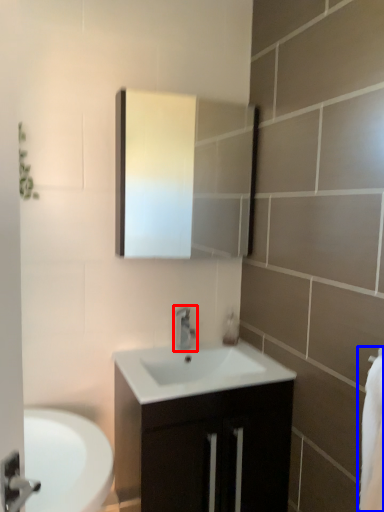
Question: Which object appears closest to the camera in this image, tap (highlighted by a red box) or bath towel (highlighted by a blue box)?

Choices:
 (A) tap
 (B) bath towel

Answer: (B)